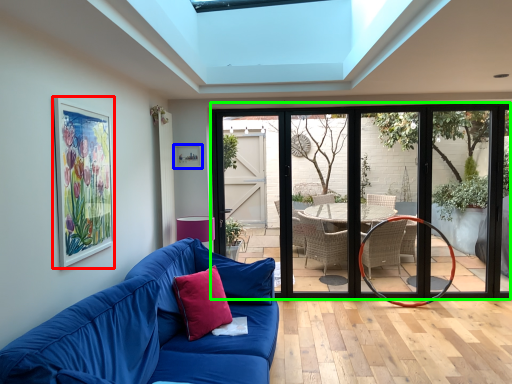
Question: Which is farther away from picture frame (highlighted by a red box)? picture frame (highlighted by a blue box) or door (highlighted by a green box)?

Choices:
 (A) picture frame
 (B) door

Answer: (B)